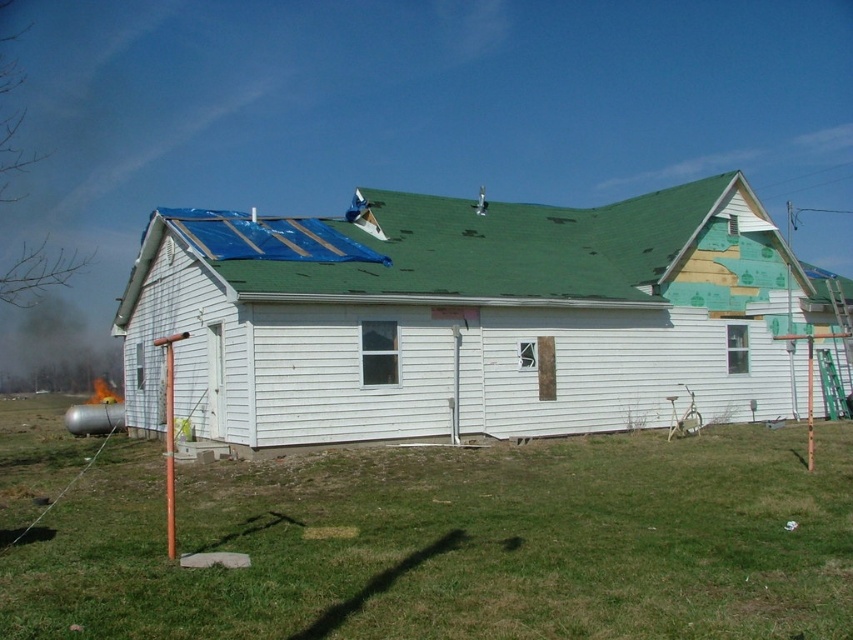
Question: Which of the following is the farthest from the observer?

Choices:
 (A) (465, 557)
 (B) (492, 256)

Answer: (B)

Question: Does green grass at lower center have a smaller size compared to green shingles at upper center?

Choices:
 (A) no
 (B) yes

Answer: (B)

Question: From the image, what is the correct spatial relationship of green grass at lower center in relation to green shingles at upper center?

Choices:
 (A) below
 (B) above

Answer: (A)

Question: Does green grass at lower center appear on the right side of green shingles at upper center?

Choices:
 (A) no
 (B) yes

Answer: (A)

Question: Which point is farther to the camera?

Choices:
 (A) (270, 470)
 (B) (650, 285)

Answer: (B)